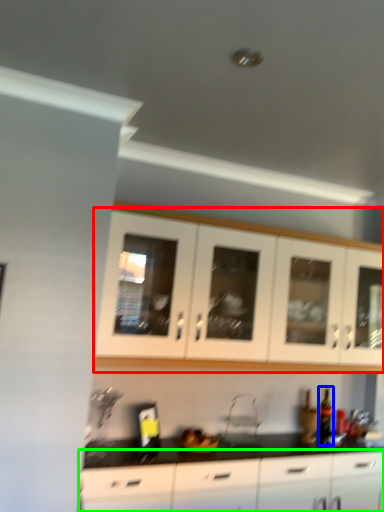
Question: Estimate the real-world distances between objects in this image. Which object is closer to cabinetry (highlighted by a red box), bottle (highlighted by a blue box) or cabinetry (highlighted by a green box)?

Choices:
 (A) bottle
 (B) cabinetry

Answer: (B)